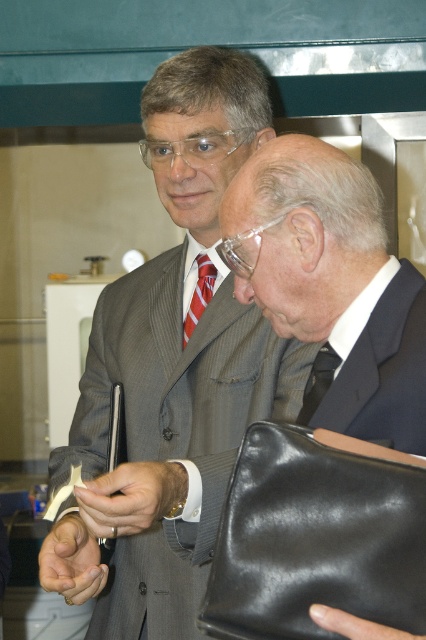
Does black leather handbag at lower center have a lesser height compared to dark blue silk tie at center?

Correct, black leather handbag at lower center is not as tall as dark blue silk tie at center.

Measure the distance between black leather handbag at lower center and camera.

black leather handbag at lower center and camera are 78.97 centimeters apart from each other.

You are a GUI agent. You are given a task and a screenshot of the screen. Output one action in this format:
    pyautogui.click(x=<x>, y=<y>)
    Task: Click on the black leather handbag at lower center
    
    Given the screenshot: What is the action you would take?
    pyautogui.click(x=354, y=625)

Which is below, matte black suit at center or black leather handbag at lower center?

black leather handbag at lower center is lower down.

Is matte black suit at center closer to the viewer compared to black leather handbag at lower center?

That is False.

Who is more forward, (247, 280) or (331, 611)?

Point (331, 611) is in front.

Locate an element on the screen. The width and height of the screenshot is (426, 640). matte black suit at center is located at coordinates (331, 282).

Where is `matte black wristwatch at center`? This screenshot has width=426, height=640. matte black wristwatch at center is located at coordinates tap(131, 497).

The width and height of the screenshot is (426, 640). Find the location of `matte black wristwatch at center`. matte black wristwatch at center is located at coordinates 131,497.